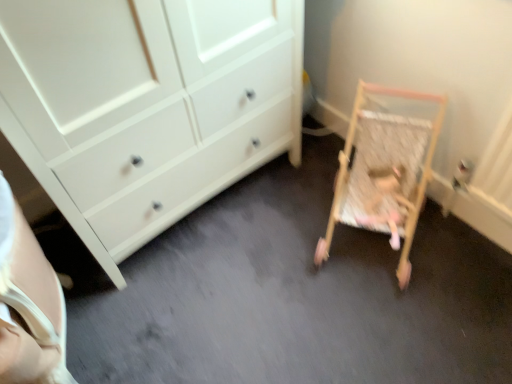
Where is `vacant area that lies to the right of wooden baby cot at lower right`? The image size is (512, 384). vacant area that lies to the right of wooden baby cot at lower right is located at coordinates 453,247.